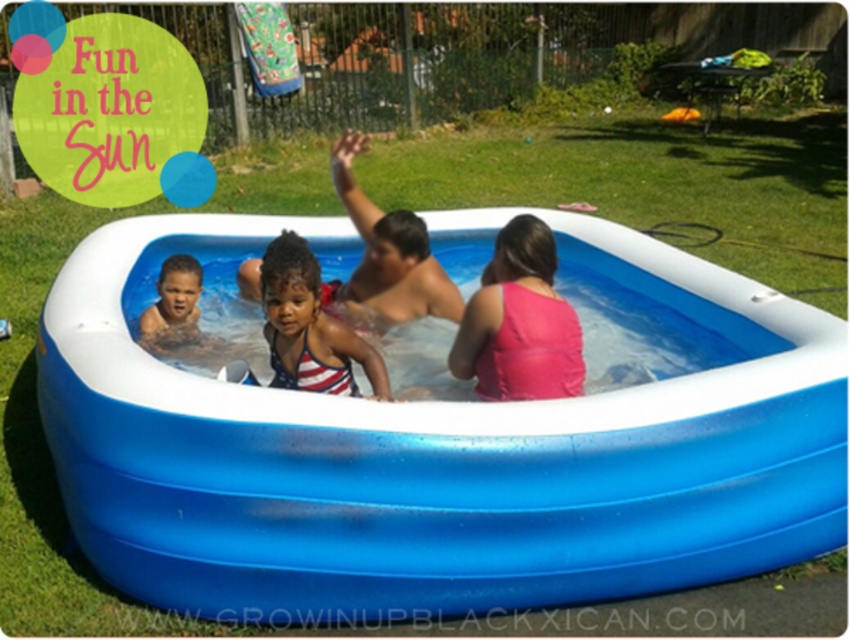
Based on the photo, you are a parent trying to ensure safety around the pool. Considering the blue rubber pool at center and the american flag swimsuit at center, which object is closer to the water surface?

The blue rubber pool at center is taller than the american flag swimsuit at center, so the american flag swimsuit at center is closer to the water surface.

You are standing at the edge of the pool and want to reach both the point at coordinates (534, 330) and the point at (329, 380). Which point will you reach first?

You will reach the point at coordinates (534, 330) first because it is closer to you than the point at (329, 380), which is further away.

You are a parent watching over the blue rubber pool at center and the matte black baby at center. From your perspective, is the baby positioned above or below the pool?

The blue rubber pool at center is below the matte black baby at center, so the baby is positioned above the pool.